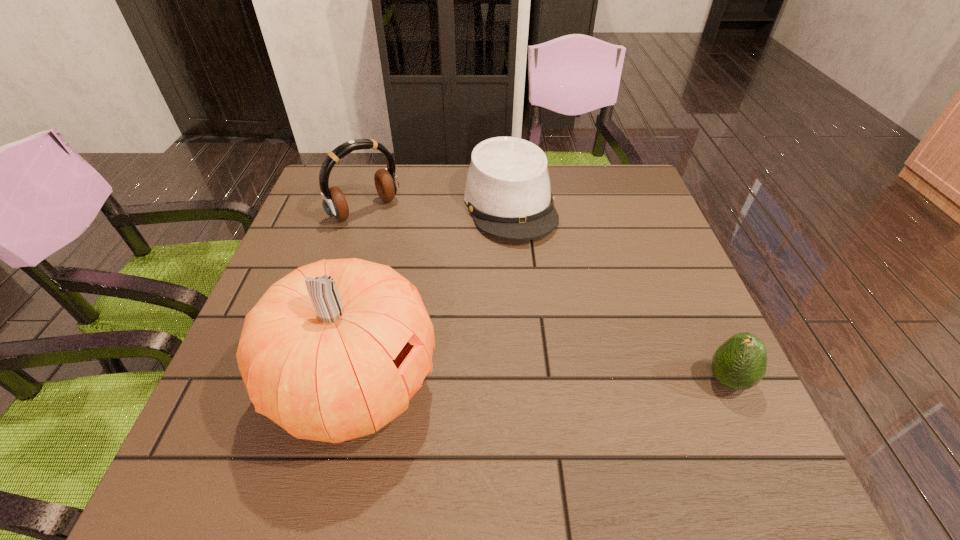
At what (x,y) coordinates should I click in order to perform the action: click on the tallest object. Please return your answer as a coordinate pair (x, y). Image resolution: width=960 pixels, height=540 pixels. Looking at the image, I should click on (333, 351).

I want to click on avocado, so click(740, 363).

This screenshot has height=540, width=960. What are the coordinates of `headset` in the screenshot? It's located at (334, 202).

At what (x,y) coordinates should I click in order to perform the action: click on hat. Please return your answer as a coordinate pair (x, y). Looking at the image, I should click on (507, 191).

Locate an element on the screen. The height and width of the screenshot is (540, 960). free space located on the front-facing side of the tallest object is located at coordinates (615, 385).

Locate an element on the screen. The width and height of the screenshot is (960, 540). free space located on the left of the rightmost object is located at coordinates (667, 381).

Where is `free space located 0.060m on the ear cup of the third shortest object`? free space located 0.060m on the ear cup of the third shortest object is located at coordinates (395, 236).

You are a GUI agent. You are given a task and a screenshot of the screen. Output one action in this format:
    pyautogui.click(x=<x>, y=<y>)
    Task: Click on the free space located on the ear cup of the third shortest object
    
    Given the screenshot: What is the action you would take?
    pyautogui.click(x=426, y=268)

Where is `vacant point located 0.150m on the ear cup of the third shortest object`? vacant point located 0.150m on the ear cup of the third shortest object is located at coordinates (413, 255).

Identify the location of free space located on the front-facing side of the hat. The height and width of the screenshot is (540, 960). (531, 266).